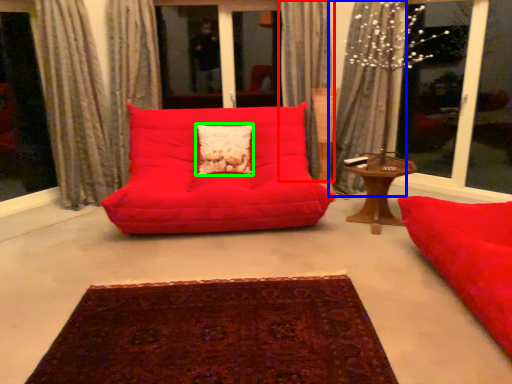
Question: Which object is the closest to the curtain (highlighted by a red box)? Choose among these: curtain (highlighted by a blue box) or pillow (highlighted by a green box).

Choices:
 (A) curtain
 (B) pillow

Answer: (A)